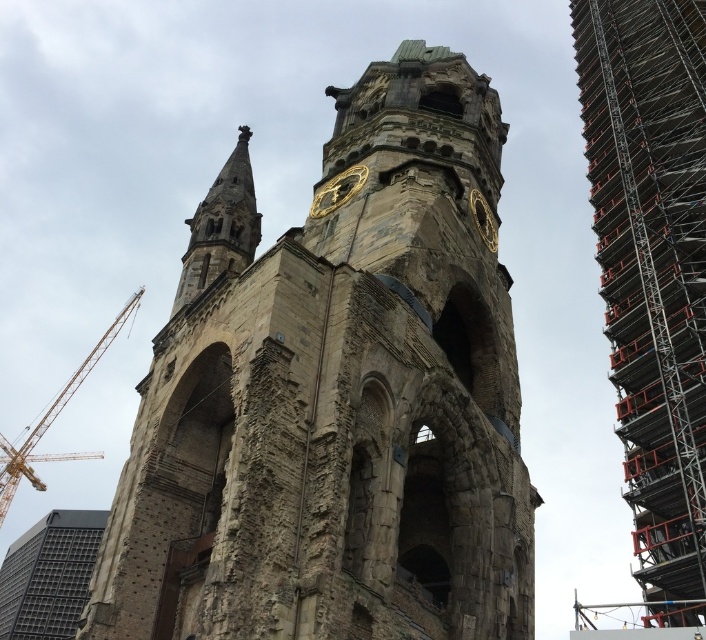
Consider the image. You are an architect reviewing the construction site of a historic stone tower. You notice a point at coordinates (335, 397). Based on the scene description, which object does this point correspond to?

The point at coordinates (335, 397) corresponds to the stone tower at center.

You are standing at the base of the historic stone tower and want to take a photo of the point at coordinates point [52,420]. If your camera has a maximum focus range of 200 meters, will you be able to focus on that point?

The distance of point [52,420] from camera is 231.59 meters, which exceeds the camera maximum focus range of 200 meters. Therefore, the camera cannot focus on that point.